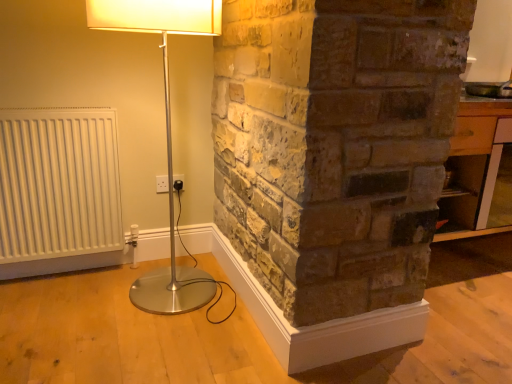
Question: Is white matte radiator at left wider or thinner than silver metallic floor lamp at left?

Choices:
 (A) wide
 (B) thin

Answer: (B)

Question: Considering the positions of white matte radiator at left and silver metallic floor lamp at left in the image, is white matte radiator at left bigger or smaller than silver metallic floor lamp at left?

Choices:
 (A) small
 (B) big

Answer: (A)

Question: Based on their relative distances, which object is farther from the silver metallic floor lamp at left?

Choices:
 (A) wooden table at right
 (B) white matte radiator at left
 (C) white plastic electric outlet at center

Answer: (A)

Question: Considering the real-world distances, which object is farthest from the white plastic electric outlet at center?

Choices:
 (A) wooden table at right
 (B) white matte radiator at left
 (C) silver metallic floor lamp at left

Answer: (A)